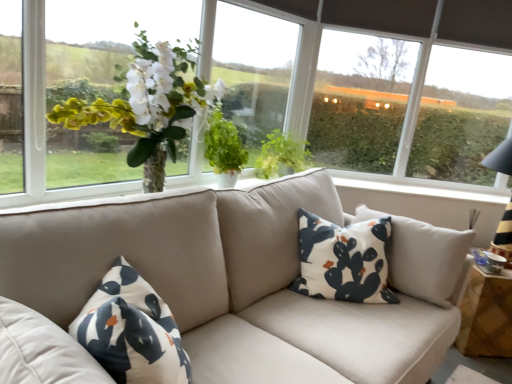
Question: Considering the positions of green leafy plant at center and transparent plastic window screen at upper right, acting as the 1th window screen starting from the right, in the image, is green leafy plant at center taller or shorter than transparent plastic window screen at upper right, acting as the 1th window screen starting from the right,?

Choices:
 (A) tall
 (B) short

Answer: (B)

Question: Does point pyautogui.click(x=278, y=130) appear closer or farther from the camera than point pyautogui.click(x=504, y=56)?

Choices:
 (A) farther
 (B) closer

Answer: (B)

Question: Estimate the real-world distances between objects in this image. Which object is closer to the green leafy plant at center?

Choices:
 (A) matte glass vase at center
 (B) transparent glass window at center, placed as the first window screen when sorted from left to right
 (C) transparent plastic window screen at upper right, the second window screen when ordered from left to right
 (D) wooden side table at right
 (E) white cotton pillow at center

Answer: (B)

Question: Which object is the farthest from the green leafy plant at center?

Choices:
 (A) white cotton pillow at center
 (B) matte glass vase at center
 (C) transparent glass window at center, placed as the first window screen when sorted from left to right
 (D) transparent plastic window screen at upper right, acting as the 1th window screen starting from the right
 (E) wooden side table at right

Answer: (D)